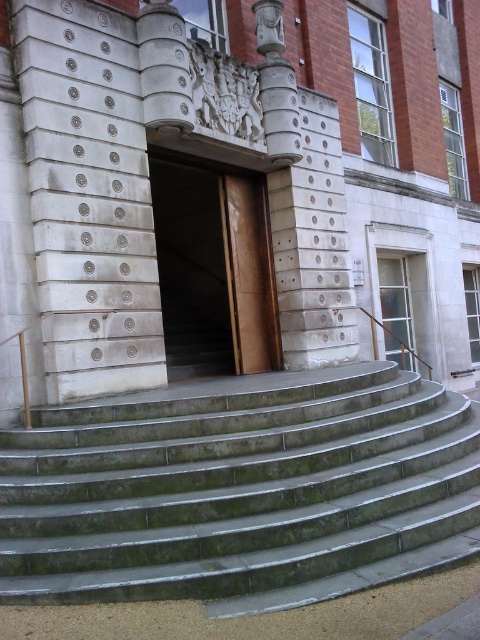
Question: Can you confirm if green marble stairs at center is positioned to the left of brown wooden door at center?

Choices:
 (A) no
 (B) yes

Answer: (A)

Question: Can you confirm if green marble stairs at center is positioned to the right of brown wooden door at center?

Choices:
 (A) yes
 (B) no

Answer: (A)

Question: Among these objects, which one is nearest to the camera?

Choices:
 (A) brown wooden door at center
 (B) green marble stairs at center

Answer: (B)

Question: Is green marble stairs at center thinner than brown wooden door at center?

Choices:
 (A) yes
 (B) no

Answer: (B)

Question: Which of the following is the farthest from the observer?

Choices:
 (A) (124, 461)
 (B) (245, 230)

Answer: (B)